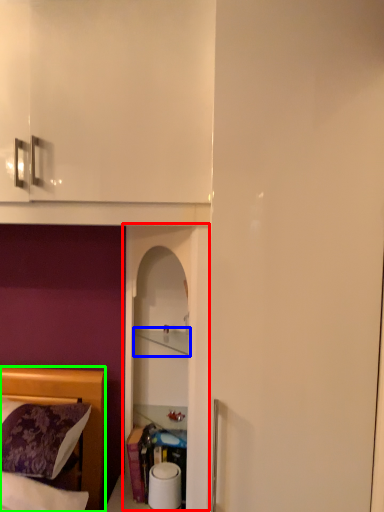
Question: Which is nearer to the glass door (highlighted by a red box)? cabinet (highlighted by a blue box) or bed (highlighted by a green box).

Choices:
 (A) cabinet
 (B) bed

Answer: (A)